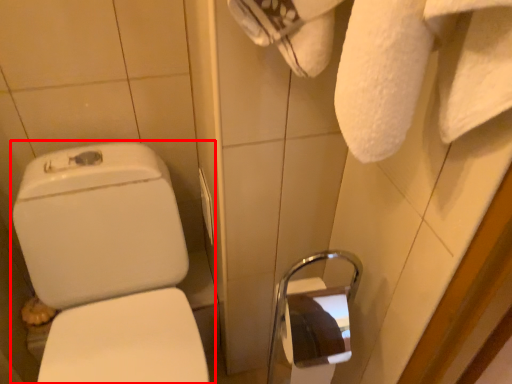
Question: From the image's perspective, where is toilet (annotated by the red box) located in relation to towel bar in the image?

Choices:
 (A) below
 (B) above

Answer: (A)